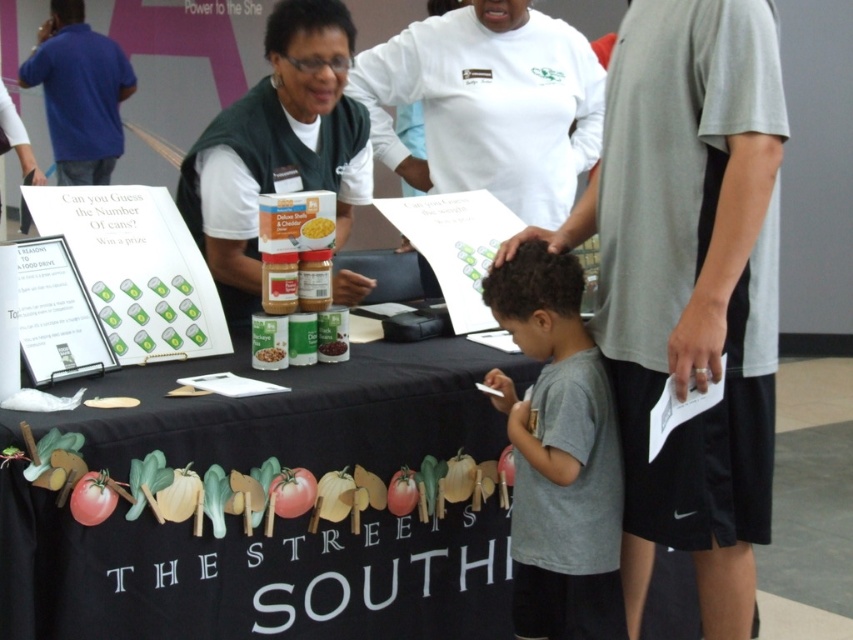
Question: Which object is positioned farthest from the black fabric table at center?

Choices:
 (A) matte plastic can at center
 (B) yellow matte corn at center
 (C) blue cotton shirt at upper left

Answer: (C)

Question: Is matte green vest at center positioned before blue cotton shirt at upper left?

Choices:
 (A) no
 (B) yes

Answer: (B)

Question: Which object is positioned farthest from the black fabric table at center?

Choices:
 (A) gray cotton shirt at lower center
 (B) yellow matte corn at center
 (C) matte plastic can at center

Answer: (B)

Question: Which is nearer to the white long-sleeved shirt at upper center?

Choices:
 (A) yellow matte corn at center
 (B) matte green vest at center
 (C) black fabric table at center
 (D) dark brown can at center

Answer: (B)

Question: Is black fabric table at center thinner than matte plastic can at center?

Choices:
 (A) yes
 (B) no

Answer: (B)

Question: Is blue cotton shirt at upper left thinner than matte plastic can at center?

Choices:
 (A) no
 (B) yes

Answer: (A)